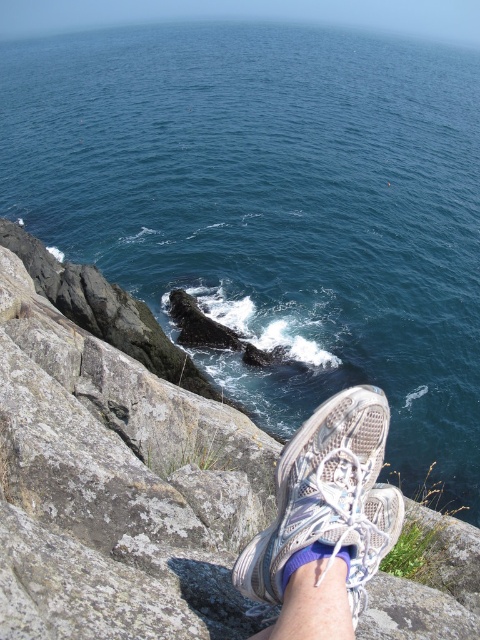
Question: Which point is closer to the camera taking this photo?

Choices:
 (A) (274, 582)
 (B) (108, 472)

Answer: (A)

Question: Is gray rock cliff at lower left wider than white mesh shoe at lower center?

Choices:
 (A) yes
 (B) no

Answer: (A)

Question: Can you confirm if gray rock cliff at lower left is wider than white mesh shoe at lower center?

Choices:
 (A) yes
 (B) no

Answer: (A)

Question: Can you confirm if gray rock cliff at lower left is bigger than white mesh shoe at lower center?

Choices:
 (A) yes
 (B) no

Answer: (A)